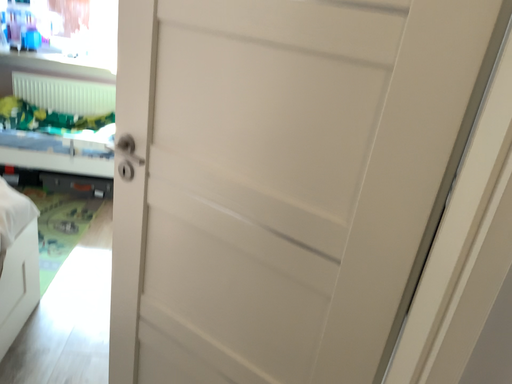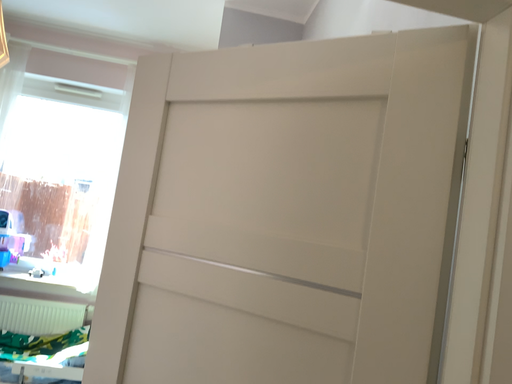
Question: Which way did the camera rotate in the video?

Choices:
 (A) rotated upward
 (B) rotated downward

Answer: (A)